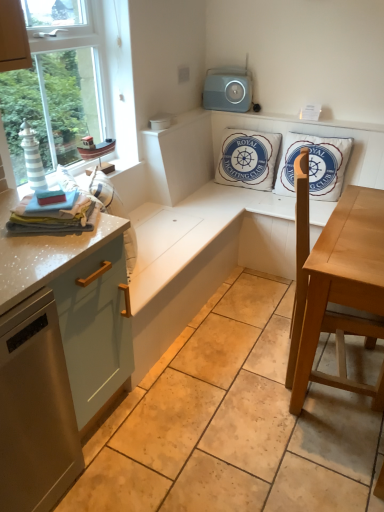
Find the location of a particular element. This screenshot has height=512, width=384. vacant space positioned to the left of light brown wooden table at center is located at coordinates (234, 383).